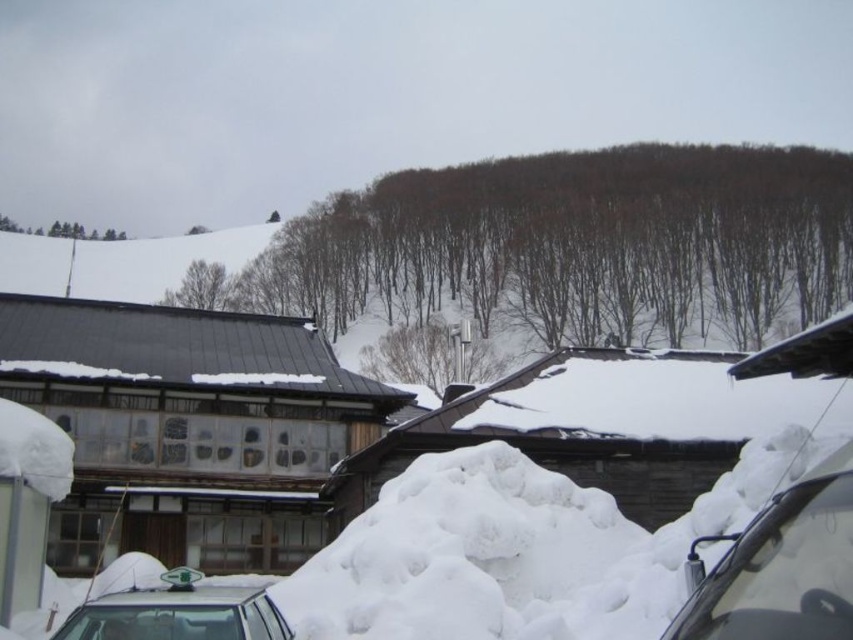
Who is shorter, brown textured trees at upper center or white glossy car at lower left?

white glossy car at lower left is shorter.

Who is higher up, brown textured trees at upper center or white glossy car at lower left?

Positioned higher is brown textured trees at upper center.

Between point (344, 326) and point (138, 598), which one is positioned behind?

Point (344, 326)

I want to click on brown textured trees at upper center, so click(x=579, y=244).

Is point (764, 205) positioned after point (74, 232)?

No, it is not.

Who is more distant from viewer, (293,301) or (107,234)?

Positioned behind is point (107,234).

Is point (515, 275) positioned before point (120, 232)?

That is True.

The height and width of the screenshot is (640, 853). What are the coordinates of `brown textured trees at upper center` in the screenshot? It's located at (579, 244).

Is brown textured trees at upper center above white fluffy snow at center?

Yes, brown textured trees at upper center is above white fluffy snow at center.

Is brown textured trees at upper center closer to camera compared to white fluffy snow at center?

No, it is behind white fluffy snow at center.

Does point (523, 209) come in front of point (473, 621)?

No, it is behind (473, 621).

What are the coordinates of `brown textured trees at upper center` in the screenshot? It's located at (579, 244).